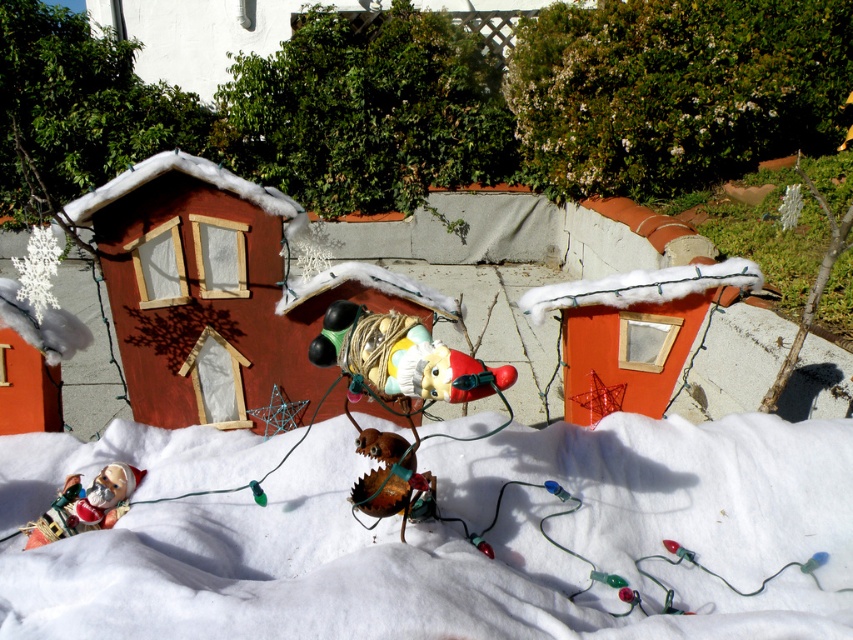
You are setting up a holiday display and have both the white fluffy snow at center and the matte plastic toy at lower left. If you want to place a small gift box between them, which object should you position closer to the gift box to ensure it doesn

The white fluffy snow at center is larger than the matte plastic toy at lower left, so you should position the matte plastic toy at lower left closer to the gift box to maintain balance between the two objects.

You are standing at the point with coordinates (74, 513) and want to walk towards the point with coordinates (780, 552). According to the scene description, will you pass in front of or behind the festive house?

According to the scene description, point (780, 552) is in front of point (74, 513). Therefore, when walking from point (74, 513) towards point (780, 552), you will be moving towards a point that is in front of your current position. This suggests that the festive house is located between these two points. Therefore, you will pass in front of the festive house.

You are standing in the festive outdoor scene. There is a point at coordinates (473, 547). What is the color of the ground at that point?

The point at coordinates (473, 547) is on white fluffy snow at center.